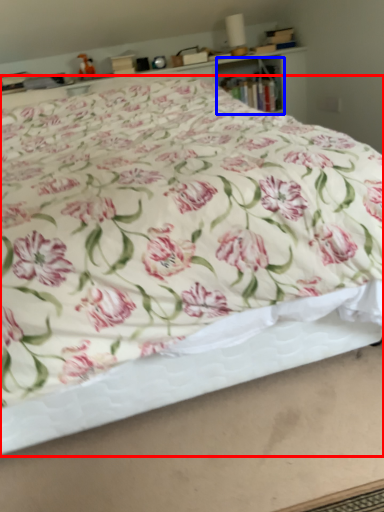
Question: Which object is further to the camera taking this photo, bed (highlighted by a red box) or cabinet (highlighted by a blue box)?

Choices:
 (A) bed
 (B) cabinet

Answer: (B)